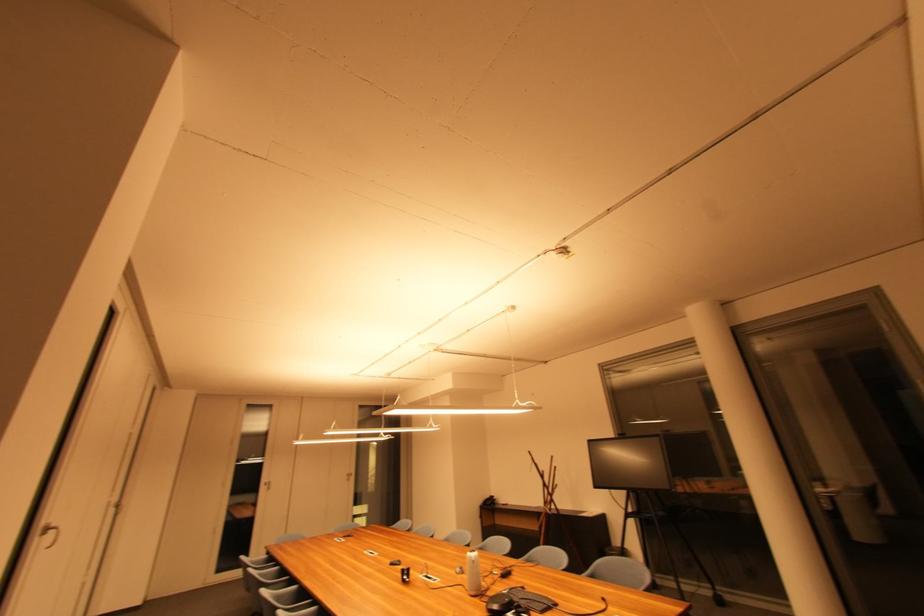
Where is `black phone receiver`? The height and width of the screenshot is (616, 924). black phone receiver is located at coordinates (517, 602).